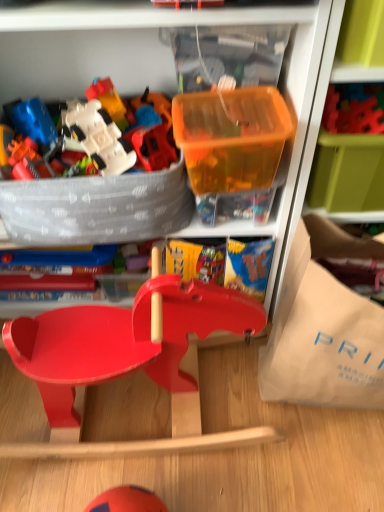
This screenshot has width=384, height=512. In order to click on vacant space underneath smooth red wooden baby carriage at center (from a real-world perspective) in this screenshot , I will do `click(134, 404)`.